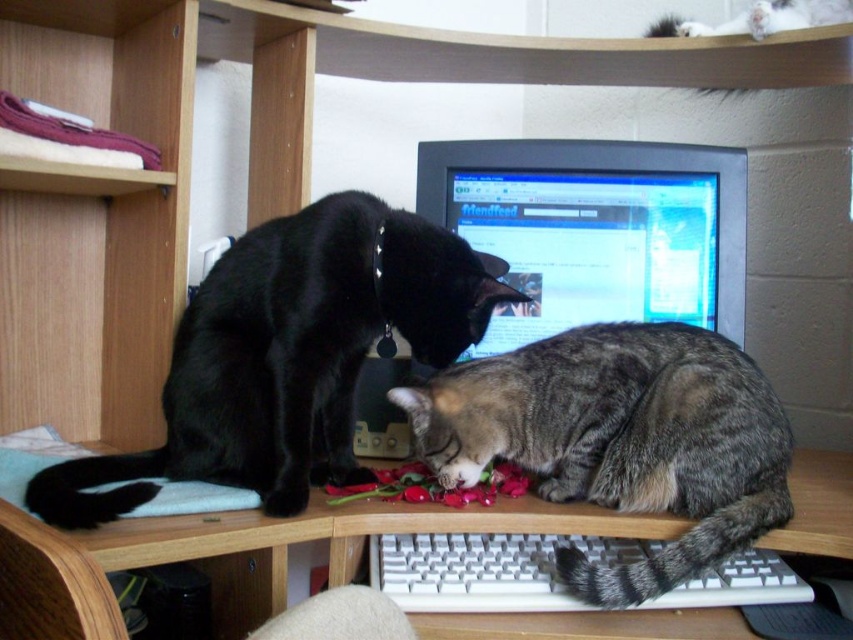
What is located at the point with coordinates (596,228)?

The point with coordinates (596,228) marks the location of the matte black monitor at center.

You are organizing a cat photo shoot and need to ensure the tabby fur cat at lower center and white plastic keyboard at lower center are both visible in the frame. Given their sizes, which object will require more space in the photo composition?

The tabby fur cat at lower center is larger in size than the white plastic keyboard at lower center, so it will require more space in the photo composition.